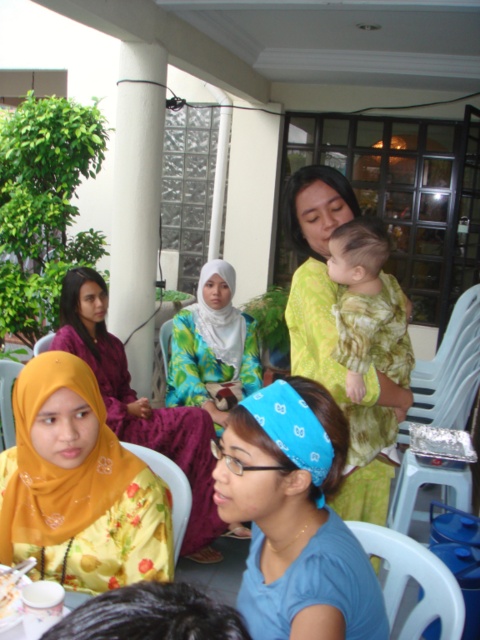
Does floral fabric hijab at center have a greater height compared to white porcelain cup at lower left?

Indeed, floral fabric hijab at center has a greater height compared to white porcelain cup at lower left.

Is floral fabric hijab at center behind white porcelain cup at lower left?

That is True.

Where is `floral fabric hijab at center`? The image size is (480, 640). floral fabric hijab at center is located at coordinates (213, 346).

This screenshot has height=640, width=480. I want to click on floral fabric hijab at center, so click(213, 346).

Does yellow floral dress at lower left have a smaller size compared to blue fabric headscarf at center?

No, yellow floral dress at lower left is not smaller than blue fabric headscarf at center.

Can you confirm if yellow floral dress at lower left is wider than blue fabric headscarf at center?

Yes.

Between point (45, 564) and point (304, 432), which one is positioned in front?

Point (304, 432)

Locate an element on the screen. The image size is (480, 640). yellow floral dress at lower left is located at coordinates (80, 493).

Which is behind, point (377, 612) or point (236, 378)?

Positioned behind is point (236, 378).

Is blue fabric headband at center further to camera compared to white satin headscarf at center?

No, it is not.

Which is in front, point (261, 502) or point (228, 310)?

Positioned in front is point (261, 502).

Locate an element on the screen. Image resolution: width=480 pixels, height=640 pixels. blue fabric headband at center is located at coordinates (295, 516).